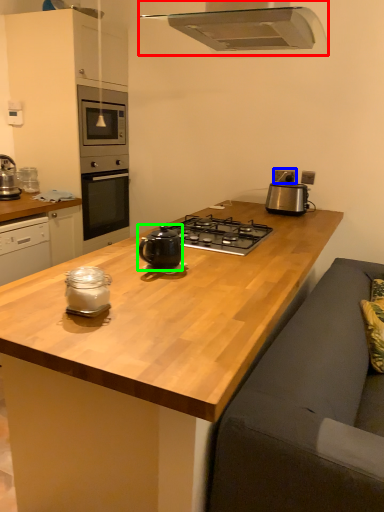
Question: Which is farther away from home appliance (highlighted by a red box)? electric outlet (highlighted by a blue box) or tea pot (highlighted by a green box)?

Choices:
 (A) electric outlet
 (B) tea pot

Answer: (A)